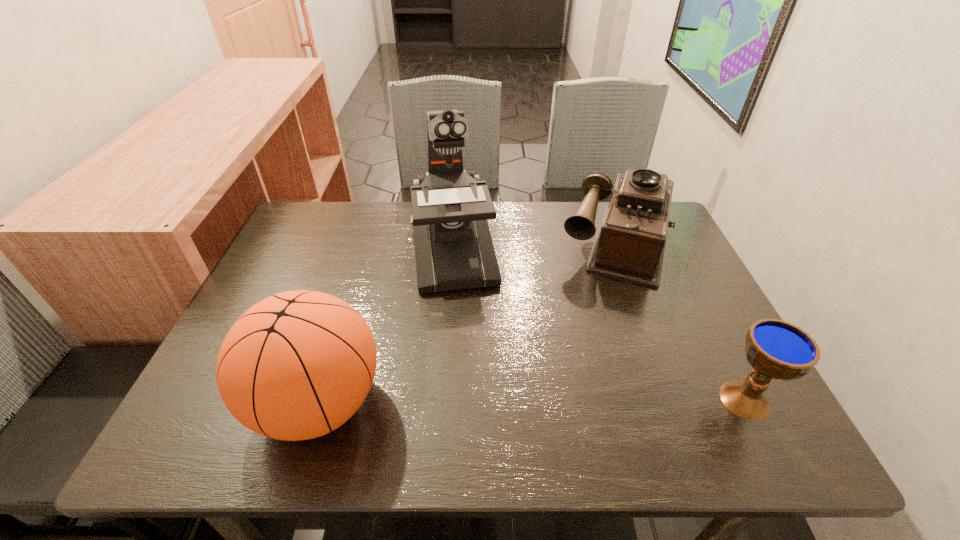
The width and height of the screenshot is (960, 540). Identify the location of vacant position located 0.070m through the eyepieces of the microscope. (461, 315).

In order to click on vacant space located 0.150m through the eyepieces of the microscope in this screenshot , I will do `click(466, 341)`.

You are a GUI agent. You are given a task and a screenshot of the screen. Output one action in this format:
    pyautogui.click(x=<x>, y=<y>)
    Task: Click on the phonograph_record that is at the far edge
    
    Given the screenshot: What is the action you would take?
    pyautogui.click(x=630, y=242)

Where is `microscope that is positioned at the far edge`? This screenshot has width=960, height=540. microscope that is positioned at the far edge is located at coordinates (454, 250).

The image size is (960, 540). What are the coordinates of `basketball that is at the near edge` in the screenshot? It's located at (297, 365).

Image resolution: width=960 pixels, height=540 pixels. I want to click on chalice that is at the near edge, so click(x=776, y=349).

The width and height of the screenshot is (960, 540). Identify the location of object present at the left edge. (297, 365).

Identify the location of chalice positioned at the right edge. This screenshot has height=540, width=960. (776, 349).

Image resolution: width=960 pixels, height=540 pixels. What are the coordinates of `phonograph_record present at the right edge` in the screenshot? It's located at (630, 242).

The width and height of the screenshot is (960, 540). I want to click on object located at the near left corner, so click(x=297, y=365).